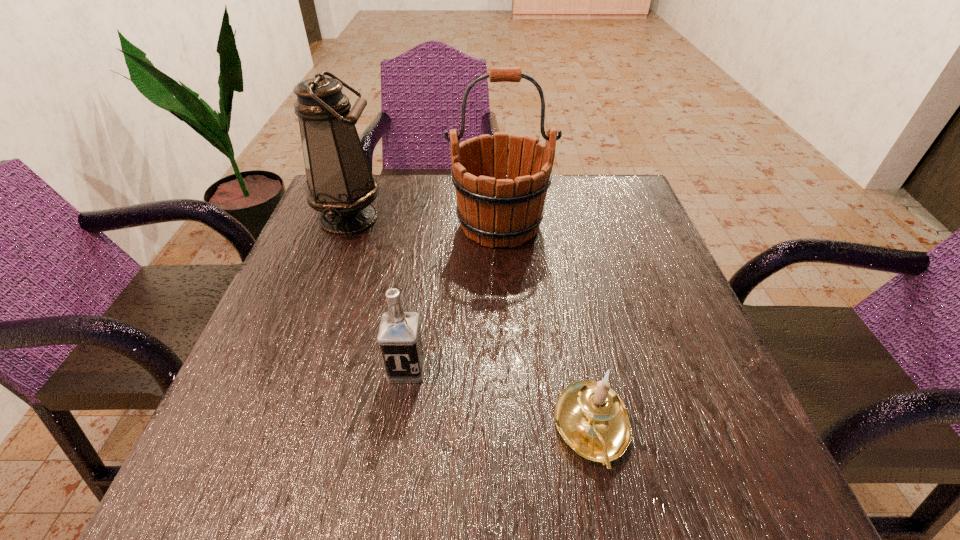
The image size is (960, 540). I want to click on oil lamp that is at the far edge, so click(340, 185).

The height and width of the screenshot is (540, 960). Find the location of `object that is at the near edge`. object that is at the near edge is located at coordinates (592, 419).

Identify the location of object present at the left edge. The height and width of the screenshot is (540, 960). (340, 185).

Where is `object that is at the far left corner`? The width and height of the screenshot is (960, 540). object that is at the far left corner is located at coordinates (340, 185).

Identify the location of free spot at the far edge of the desktop. (399, 185).

The width and height of the screenshot is (960, 540). What are the coordinates of `blank space at the near edge of the desktop` in the screenshot? It's located at (546, 501).

The width and height of the screenshot is (960, 540). In order to click on vacant space at the left edge of the desktop in this screenshot , I will do `click(278, 308)`.

Where is `vacant space at the right edge`? The width and height of the screenshot is (960, 540). vacant space at the right edge is located at coordinates point(669,369).

What are the coordinates of `vacant area at the far right corner of the desktop` in the screenshot? It's located at (614, 226).

The height and width of the screenshot is (540, 960). In the image, there is a desktop. Identify the location of vacant space at the near right corner. (691, 455).